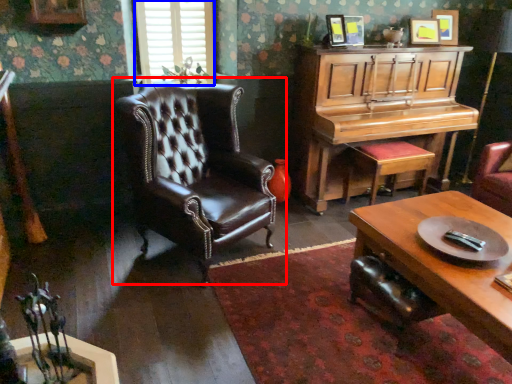
Question: Which object appears closest to the camera in this image, chair (highlighted by a red box) or window (highlighted by a blue box)?

Choices:
 (A) chair
 (B) window

Answer: (A)